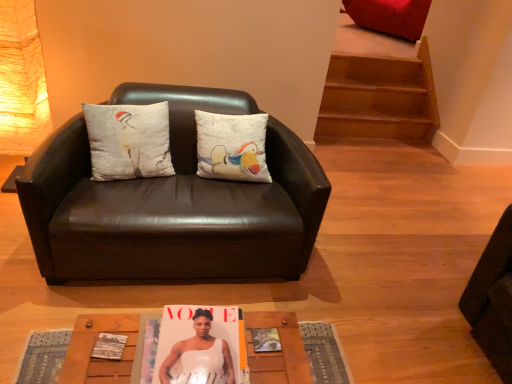
Question: Is white cotton cushion at center taller or shorter than matte paper magazine at center?

Choices:
 (A) short
 (B) tall

Answer: (B)

Question: From a real-world perspective, is white cotton cushion at center positioned above or below matte paper magazine at center?

Choices:
 (A) below
 (B) above

Answer: (B)

Question: Which object is positioned farthest from the white glossy magazine at center?

Choices:
 (A) black leather couch at center
 (B) wooden textured table at lower center
 (C) matte paper magazine at center
 (D) white cotton cushion at center

Answer: (D)

Question: Considering the real-world distances, which object is farthest from the white cotton cushion at center?

Choices:
 (A) matte paper magazine at center
 (B) wooden textured table at lower center
 (C) black leather couch at center
 (D) white glossy magazine at center

Answer: (B)